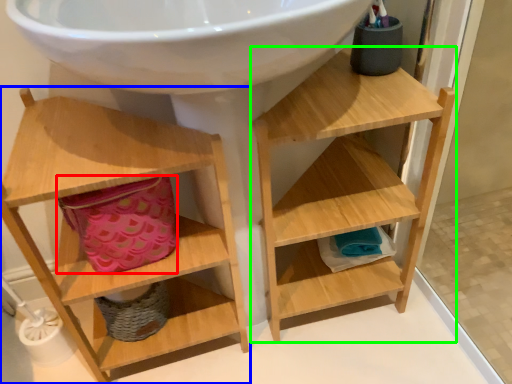
Question: Based on their relative distances, which object is nearer to basket (highlighted by a red box)? Choose from shelf (highlighted by a blue box) and shelf (highlighted by a green box).

Choices:
 (A) shelf
 (B) shelf

Answer: (A)